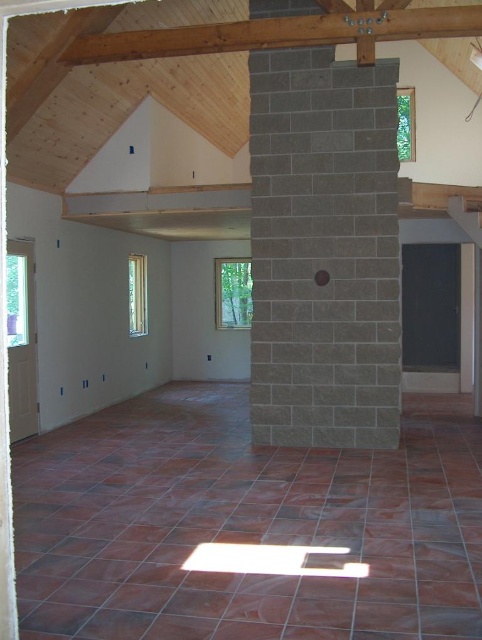
The image size is (482, 640). What do you see at coordinates (323, 250) in the screenshot?
I see `gray stone pillar at center` at bounding box center [323, 250].

Who is taller, gray stone pillar at center or brown wooden beam at upper center?

With more height is gray stone pillar at center.

What do you see at coordinates (323, 250) in the screenshot? I see `gray stone pillar at center` at bounding box center [323, 250].

Identify the location of gray stone pillar at center. The image size is (482, 640). (323, 250).